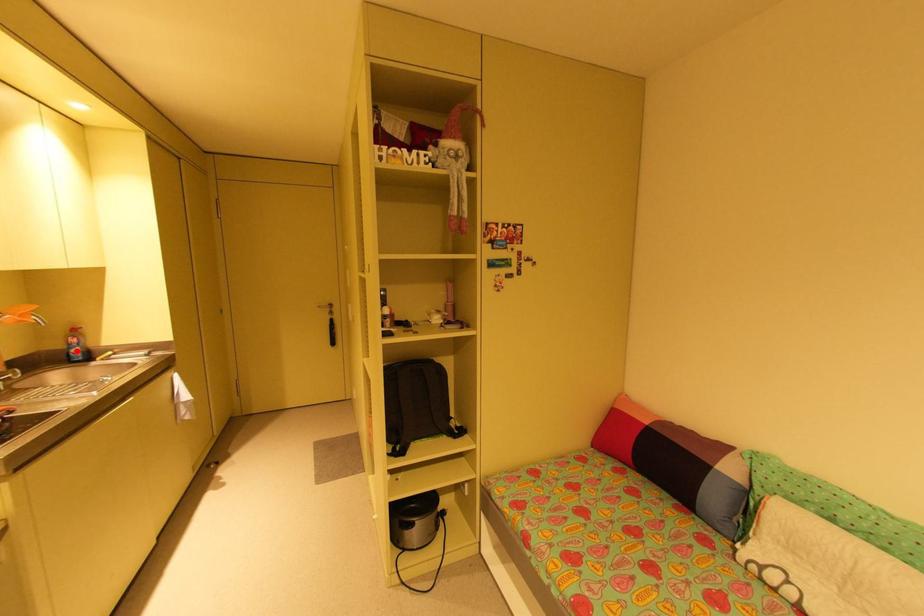
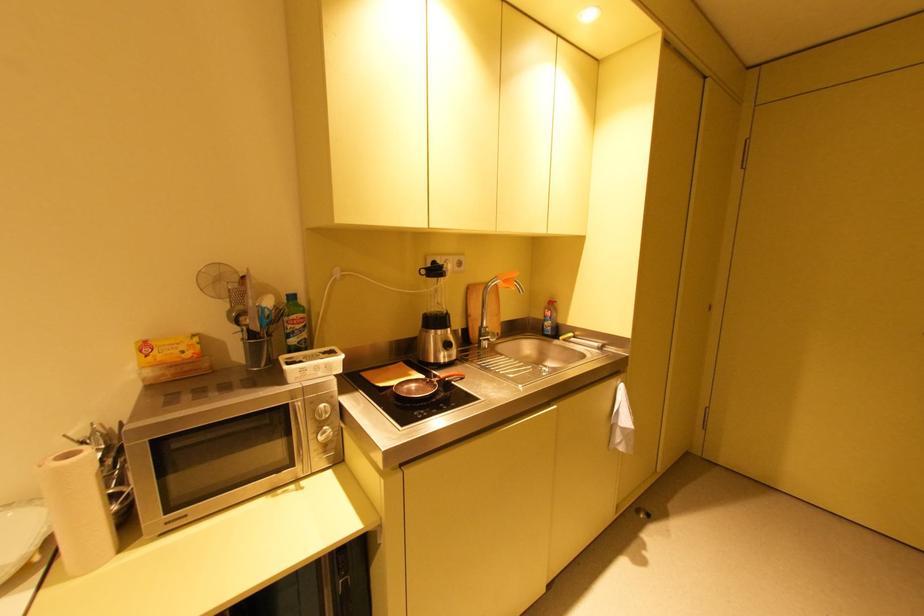
In the second image, find the point that corresponds to the highlighted location in the first image.

(551, 323)